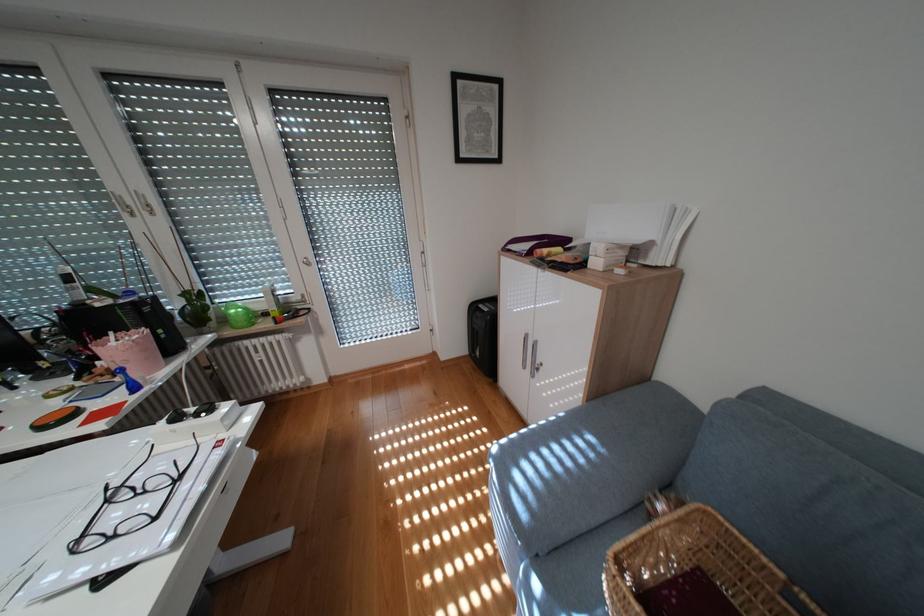
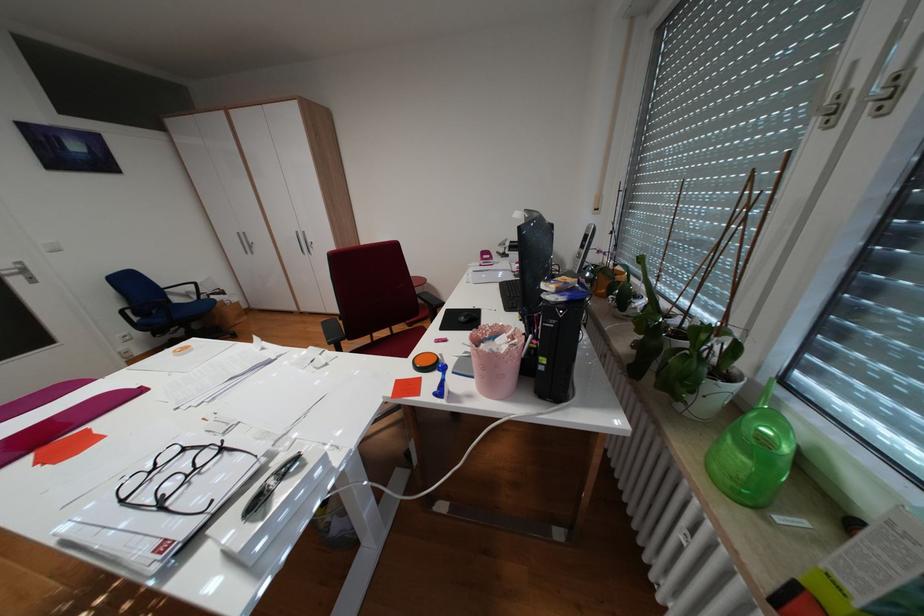
Find the pixel in the second image that matches pixel 252 323 in the first image.

(727, 466)